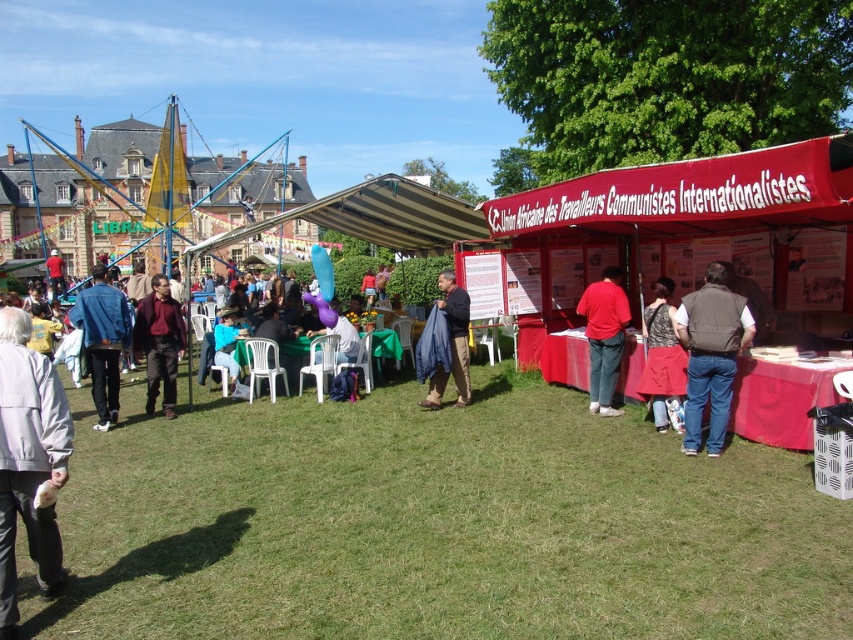
Between gray fabric jacket at lower left and red matte shirt at center, which one is positioned lower?

gray fabric jacket at lower left is lower down.

You are a GUI agent. You are given a task and a screenshot of the screen. Output one action in this format:
    pyautogui.click(x=<x>, y=<y>)
    Task: Click on the gray fabric jacket at lower left
    This screenshot has height=640, width=853.
    Given the screenshot: What is the action you would take?
    pyautogui.click(x=28, y=460)

Who is more distant from viewer, (6, 496) or (606, 364)?

Positioned behind is point (606, 364).

Identify the location of gray fabric jacket at lower left. The width and height of the screenshot is (853, 640). (28, 460).

Who is more forward, (172, 371) or (233, 317)?

Point (172, 371) is more forward.

How distant is burgundy fabric shirt at center from blue fabric chair at lower center?

burgundy fabric shirt at center is 21.34 feet away from blue fabric chair at lower center.

Find the location of a particular element. The image size is (853, 640). burgundy fabric shirt at center is located at coordinates (160, 342).

Is green grass at lower center thinner than red matte shirt at center?

No, green grass at lower center is not thinner than red matte shirt at center.

Can you confirm if green grass at lower center is smaller than red matte shirt at center?

No.

Find the location of `green grass at lower center`. green grass at lower center is located at coordinates (436, 524).